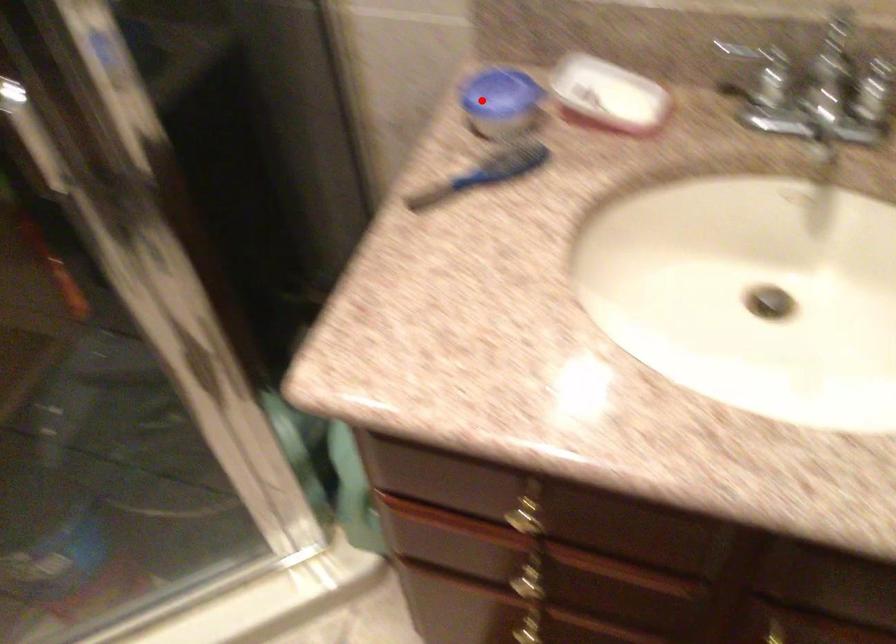
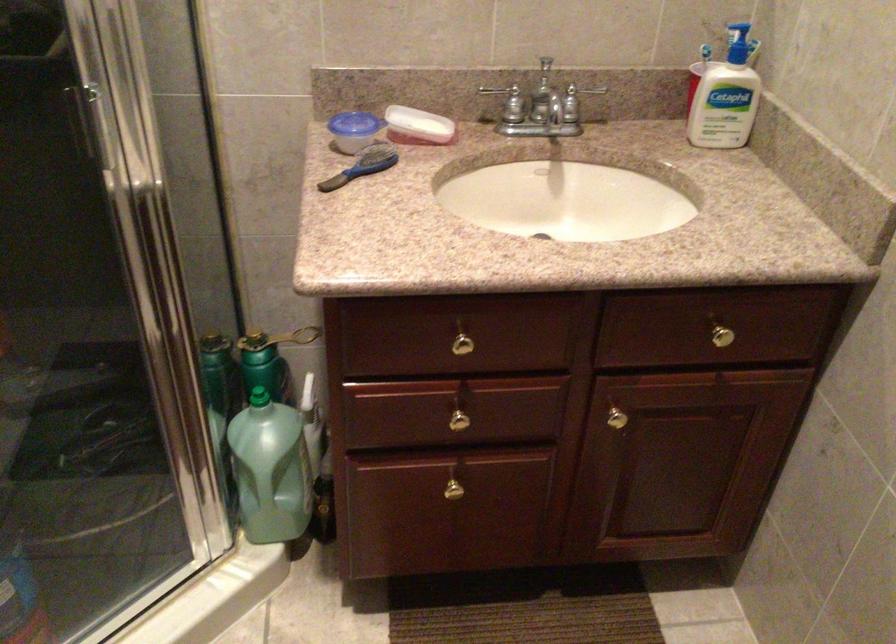
Question: I am providing you with two images of the same scene from different viewpoints. Image1 has a red point marked. In image2, the corresponding 3D location appears at what relative position? Reply with the corresponding letter.

Choices:
 (A) Closer
 (B) Farther

Answer: (B)